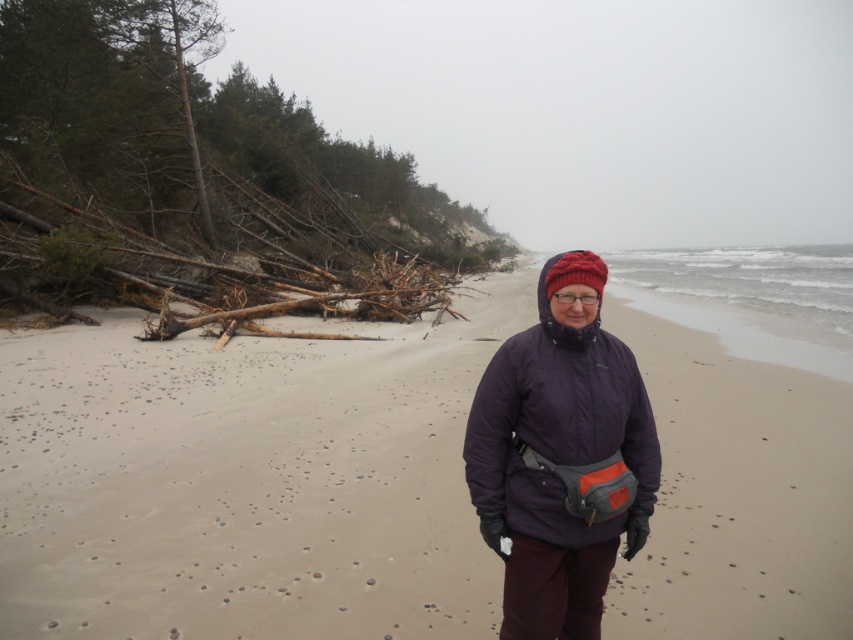
Who is more forward, (376, 579) or (592, 269)?

Point (592, 269) is more forward.

Is smooth sand at center behind red knitted hat at center?

Yes, it is behind red knitted hat at center.

Is point (747, 484) closer to camera compared to point (556, 262)?

No, (747, 484) is further to viewer.

This screenshot has height=640, width=853. Identify the location of smooth sand at center. (247, 481).

Can you confirm if purple synthetic jacket at center is smaller than red knitted hat at center?

Actually, purple synthetic jacket at center might be larger than red knitted hat at center.

Between point (579, 346) and point (573, 268), which one is positioned behind?

The point (579, 346) is more distant.

Find the location of `purple synthetic jacket at center`. purple synthetic jacket at center is located at coordinates (555, 424).

From the picture: Who is higher up, smooth sand at center or purple synthetic jacket at center?

Positioned higher is purple synthetic jacket at center.

Identify the location of smooth sand at center. (247, 481).